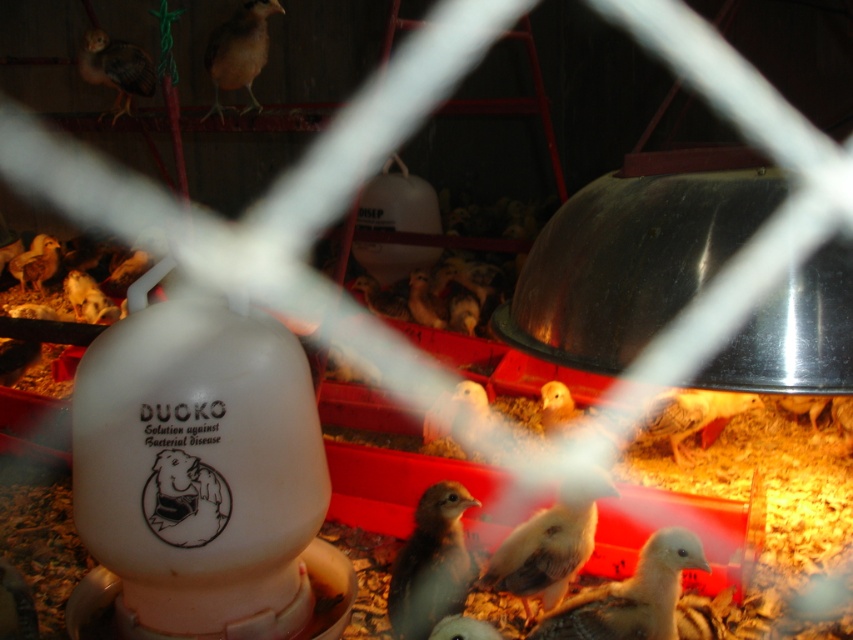
Is light yellow feathers at center thinner than brown feathered chick at upper left?

Yes.

Between light yellow feathers at center and brown feathered chick at upper left, which one is positioned lower?

light yellow feathers at center

Is point (589, 637) positioned after point (77, 65)?

That is False.

At what (x,y) coordinates should I click in order to perform the action: click on light yellow feathers at center. Please return your answer as a coordinate pair (x, y). Looking at the image, I should click on (630, 595).

Between light yellow feathers at center and light brown feathers at center, which one is positioned higher?

Positioned higher is light brown feathers at center.

Can you confirm if light yellow feathers at center is positioned to the right of light brown feathers at center?

Indeed, light yellow feathers at center is positioned on the right side of light brown feathers at center.

Which is in front, point (656, 564) or point (534, 564)?

Point (656, 564)

Find the location of a particular element. Image resolution: width=853 pixels, height=640 pixels. light yellow feathers at center is located at coordinates (630, 595).

Between point (399, 577) and point (234, 76), which one is positioned in front?

Point (399, 577) is more forward.

How far apart are light brown feathered chick at center and brown feathered bird at upper left?

light brown feathered chick at center is 2.00 meters from brown feathered bird at upper left.

Is point (456, 593) closer to viewer compared to point (265, 52)?

Yes.

The image size is (853, 640). I want to click on light brown feathered chick at center, so click(431, 563).